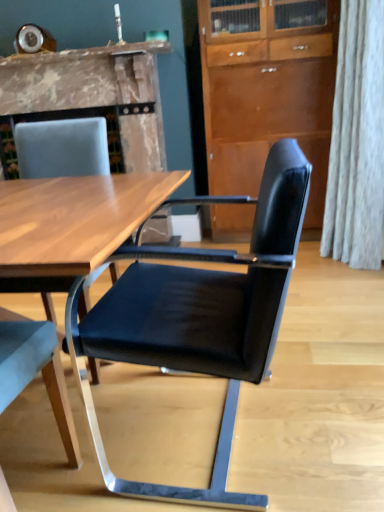
Where is `vacant region below black leather chair at center, which is the second chair in left-to-right order (from a real-world perspective)`? The width and height of the screenshot is (384, 512). vacant region below black leather chair at center, which is the second chair in left-to-right order (from a real-world perspective) is located at coordinates (201, 431).